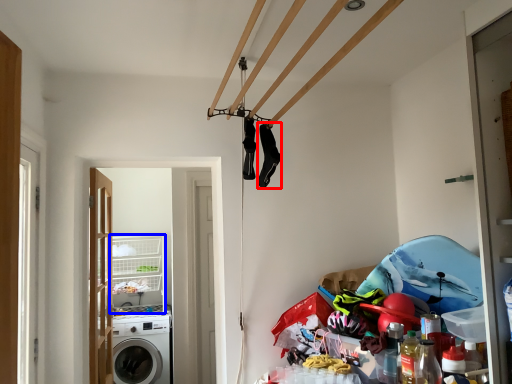
Question: Which object is further to the camera taking this photo, clothing (highlighted by a red box) or shelf (highlighted by a blue box)?

Choices:
 (A) clothing
 (B) shelf

Answer: (B)